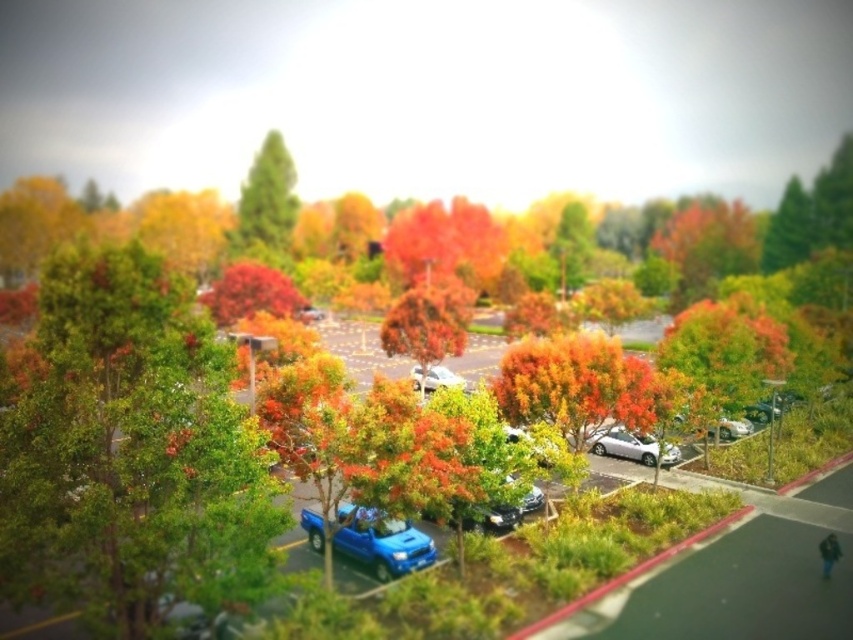
Question: Estimate the real-world distances between objects in this image. Which object is closer to the silver metallic car at center-right?

Choices:
 (A) green matte tree at upper center
 (B) satin silver sedan at center

Answer: (B)

Question: Can you confirm if shiny blue pickup truck at center is thinner than silver metallic sedan at center-right?

Choices:
 (A) yes
 (B) no

Answer: (A)

Question: Does green matte tree at left come behind satin silver sedan at center?

Choices:
 (A) no
 (B) yes

Answer: (A)

Question: Which object appears farthest from the camera in this image?

Choices:
 (A) green matte tree at left
 (B) metallic silver sedan at center-right
 (C) green matte tree at upper center

Answer: (C)

Question: From the image, what is the correct spatial relationship of orange matte tree at center in relation to metallic silver sedan at center-right?

Choices:
 (A) below
 (B) above

Answer: (B)

Question: Which point is closer to the camera?

Choices:
 (A) (653, 460)
 (B) (405, 349)
 (C) (247, 589)
 (D) (421, 544)

Answer: (C)